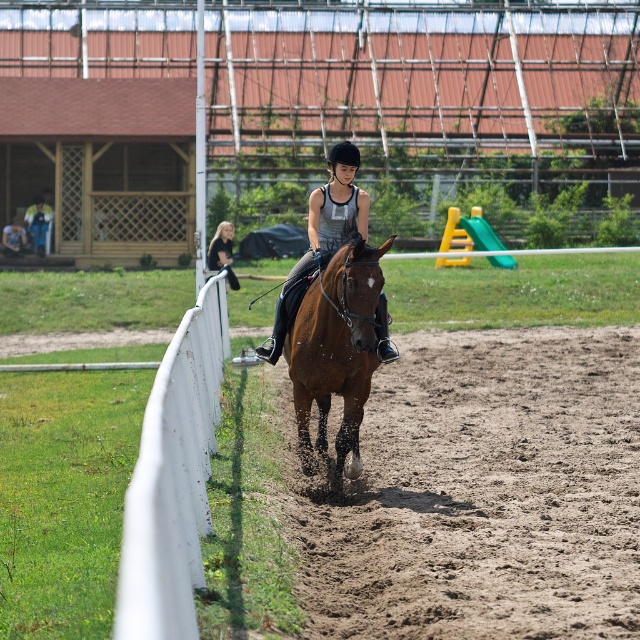
Is brown glossy horse at center positioned at the back of shiny black helmet at center?

No, it is not.

Between brown glossy horse at center and shiny black helmet at center, which one has less height?

Standing shorter between the two is brown glossy horse at center.

Does point (291, 365) lie in front of point (272, 355)?

Yes, it is.

This screenshot has width=640, height=640. I want to click on brown glossy horse at center, so click(336, 349).

Locate an element on the screen. The image size is (640, 640). brown glossy horse at center is located at coordinates (336, 349).

Which of these two, brown glossy horse at center or black leather jacket at upper center, stands taller?

brown glossy horse at center is taller.

Between point (364, 244) and point (230, 227), which one is positioned in front?

Positioned in front is point (364, 244).

This screenshot has width=640, height=640. Find the location of `brown glossy horse at center`. brown glossy horse at center is located at coordinates (336, 349).

Does shiny black helmet at center come in front of black leather jacket at upper center?

Yes, it is in front of black leather jacket at upper center.

Does shiny black helmet at center appear over black leather jacket at upper center?

Incorrect, shiny black helmet at center is not positioned above black leather jacket at upper center.

Is point (300, 269) positioned before point (232, 284)?

Yes.

Identify the location of shiny black helmet at center. (321, 237).